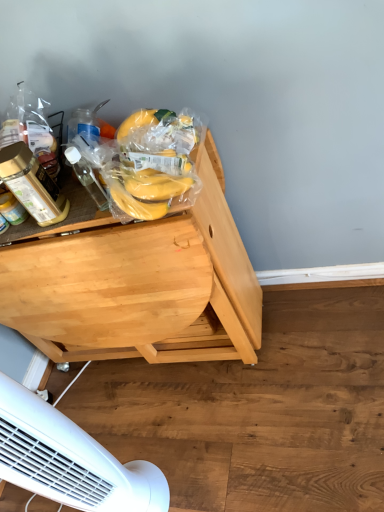
Question: Are yellow matte bananas at upper left, placed as the 2th food when sorted from bottom to top, and light wood desk at center far apart?

Choices:
 (A) no
 (B) yes

Answer: (A)

Question: Is yellow matte bananas at upper left, placed as the 2th food when sorted from bottom to top, facing towards light wood desk at center?

Choices:
 (A) no
 (B) yes

Answer: (A)

Question: Does yellow matte bananas at upper left, placed as the 2th food when sorted from bottom to top, have a larger size compared to light wood desk at center?

Choices:
 (A) no
 (B) yes

Answer: (A)

Question: Is yellow matte bananas at upper left, placed as the 2th food when sorted from bottom to top, not within light wood desk at center?

Choices:
 (A) yes
 (B) no

Answer: (A)

Question: Is yellow matte bananas at upper left, placed as the 2th food when sorted from bottom to top, thinner than light wood desk at center?

Choices:
 (A) yes
 (B) no

Answer: (A)

Question: From a real-world perspective, is yellow matte bananas at upper left, placed as the 2th food when sorted from bottom to top, below light wood desk at center?

Choices:
 (A) yes
 (B) no

Answer: (B)

Question: From the image's perspective, does yellow matte bananas at upper left, which is the 1th food from top to bottom, appear lower than transparent plastic bottle at left, which is counted as the 1th bottle, starting from the right?

Choices:
 (A) no
 (B) yes

Answer: (A)

Question: Can you confirm if yellow matte bananas at upper left, which is the 1th food from top to bottom, is thinner than transparent plastic bottle at left, which is counted as the second bottle, starting from the left?

Choices:
 (A) no
 (B) yes

Answer: (A)

Question: Can you confirm if yellow matte bananas at upper left, which is the 1th food from top to bottom, is taller than transparent plastic bottle at left, which is counted as the second bottle, starting from the left?

Choices:
 (A) no
 (B) yes

Answer: (A)

Question: Is yellow matte bananas at upper left, placed as the 2th food when sorted from bottom to top, wider than transparent plastic bottle at left, which is counted as the second bottle, starting from the left?

Choices:
 (A) no
 (B) yes

Answer: (B)

Question: Is yellow matte bananas at upper left, which is the 1th food from top to bottom, bigger than transparent plastic bottle at left, which is counted as the 1th bottle, starting from the right?

Choices:
 (A) yes
 (B) no

Answer: (A)

Question: Could you tell me if yellow matte bananas at upper left, which is the 1th food from top to bottom, is facing transparent plastic bottle at left, which is counted as the second bottle, starting from the left?

Choices:
 (A) no
 (B) yes

Answer: (B)

Question: Does translucent plastic bottle at left, which appears as the 1th bottle when viewed from the left, come behind yellow matte bananas at center, which is counted as the 1th food, starting from the bottom?

Choices:
 (A) no
 (B) yes

Answer: (B)